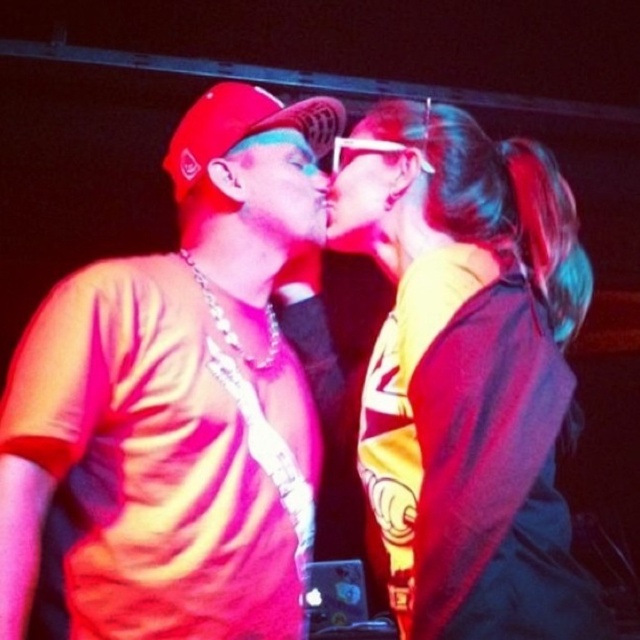
Measure the distance between matte black face at center and matte plastic face at center.

matte black face at center is 2.53 inches from matte plastic face at center.

Is point (243, 198) closer to camera compared to point (365, 216)?

No, (243, 198) is behind (365, 216).

Locate an element on the screen. matte black face at center is located at coordinates (282, 193).

Can you confirm if yellow fabric at center is thinner than matte black face at center?

No.

Does point (500, 346) lie behind point (260, 150)?

No, it is in front of (260, 150).

The width and height of the screenshot is (640, 640). In order to click on yellow fabric at center in this screenshot , I will do `click(467, 371)`.

Is matte red cap at center further to camera compared to yellow fabric at center?

Yes, it is.

Where is `matte red cap at center`? This screenshot has width=640, height=640. matte red cap at center is located at coordinates (170, 413).